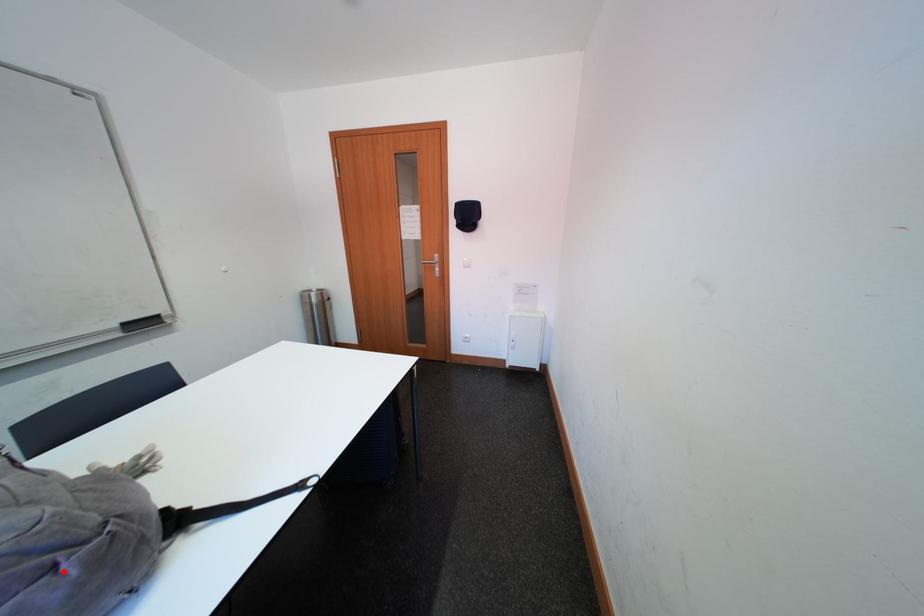
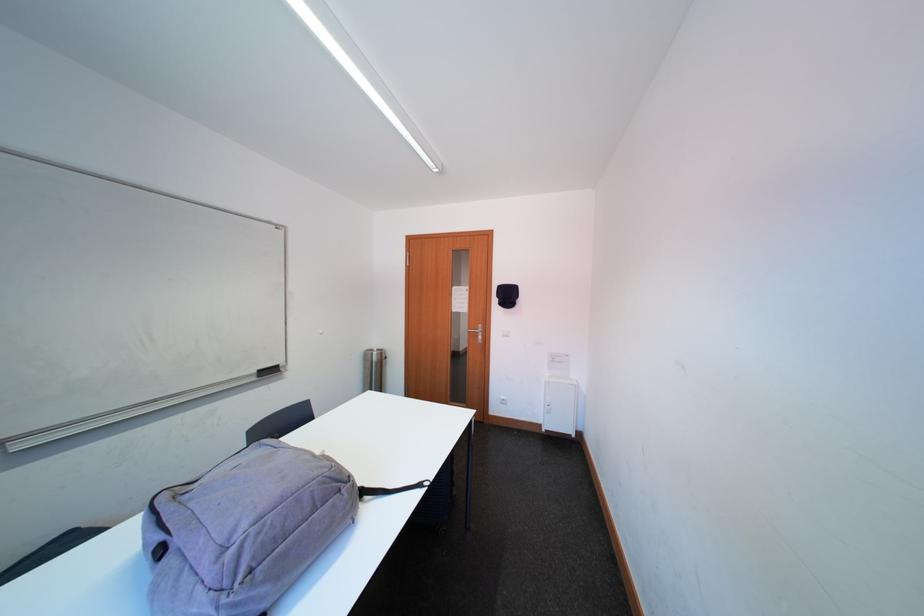
Where in the second image is the point corresponding to the highlighted location from the first image?

(349, 493)